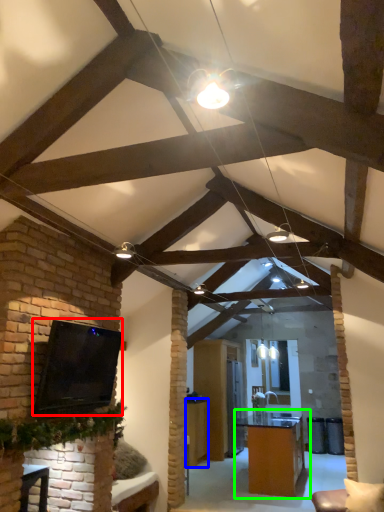
Question: Estimate the real-world distances between objects in this image. Which object is closer to open (highlighted by a red box), table (highlighted by a blue box) or table (highlighted by a green box)?

Choices:
 (A) table
 (B) table

Answer: (B)